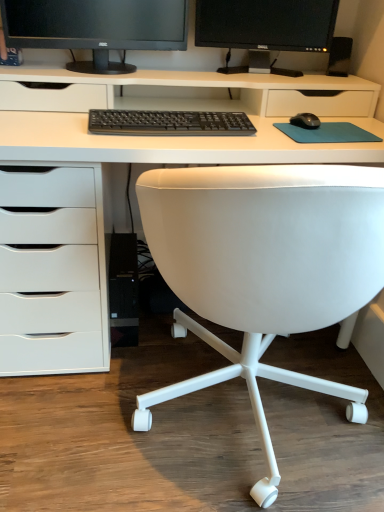
This screenshot has height=512, width=384. I want to click on free region under black glossy monitor at upper center, the 1th computer monitor in the right-to-left sequence (from a real-world perspective), so click(258, 72).